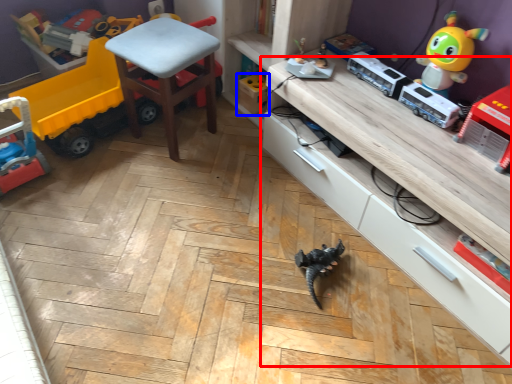
Question: Which object is closer to the camera taking this photo, cabinetry (highlighted by a red box) or toy (highlighted by a blue box)?

Choices:
 (A) cabinetry
 (B) toy

Answer: (A)